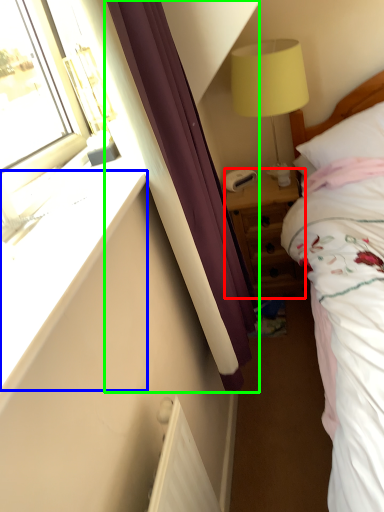
Question: Which object is the closest to the nightstand (highlighted by a red box)? Choose among these: window sill (highlighted by a blue box) or curtain (highlighted by a green box).

Choices:
 (A) window sill
 (B) curtain

Answer: (B)